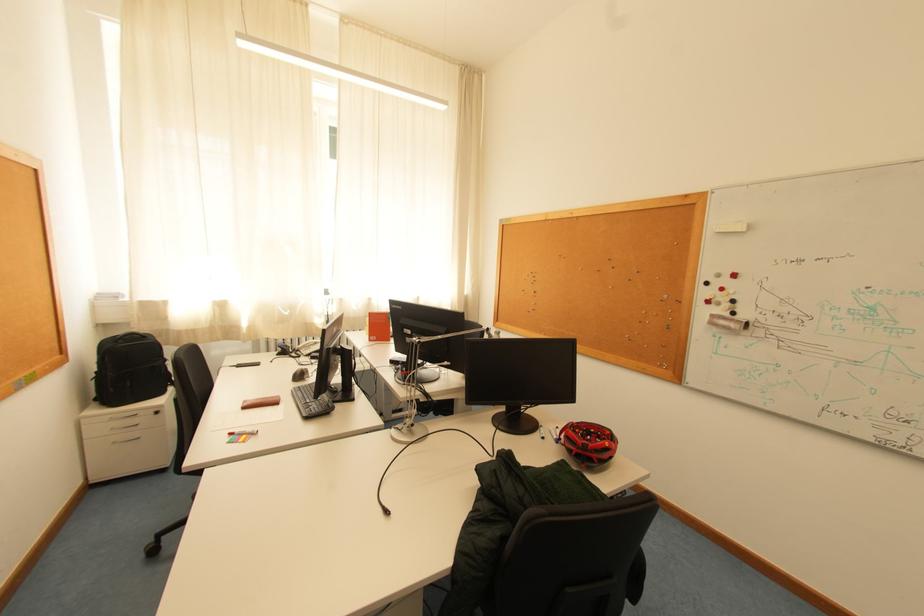
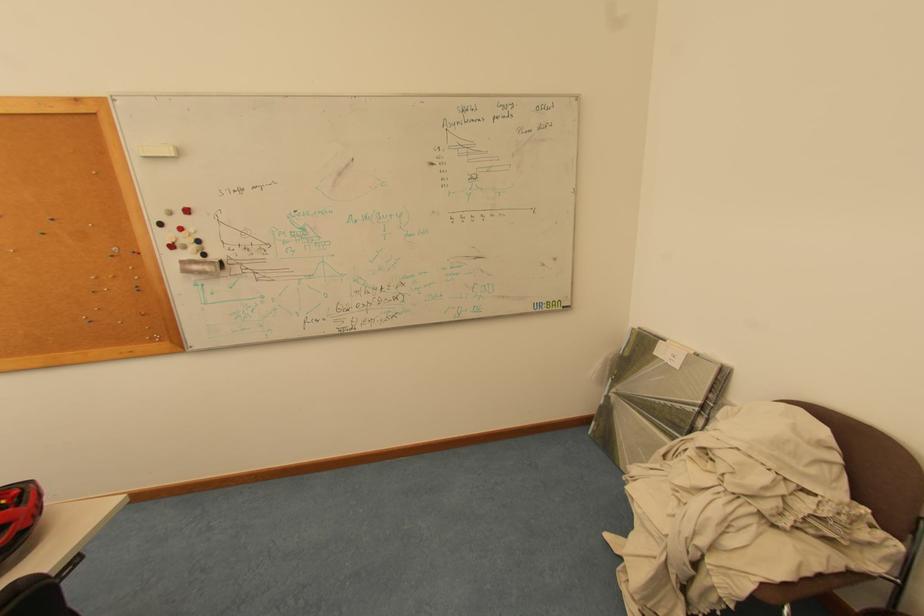
Where in the second image is the point corresponding to point (726, 233) from the first image?

(152, 156)